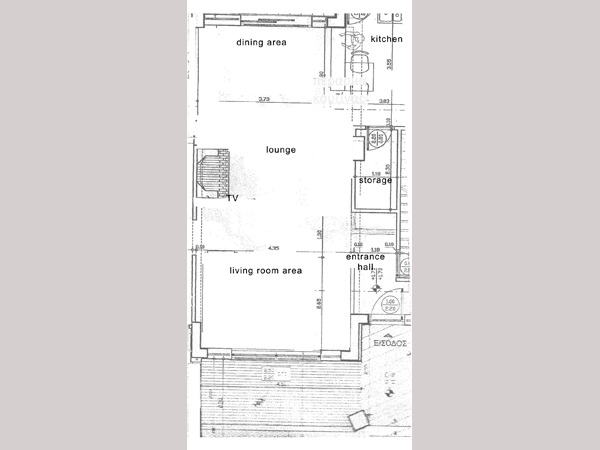
You are a GUI agent. You are given a task and a screenshot of the screen. Output one action in this format:
    pyautogui.click(x=<x>, y=<y>)
    Task: Click on the kitchen
    The image size is (600, 450).
    Given the screenshot: What is the action you would take?
    pyautogui.click(x=385, y=39)